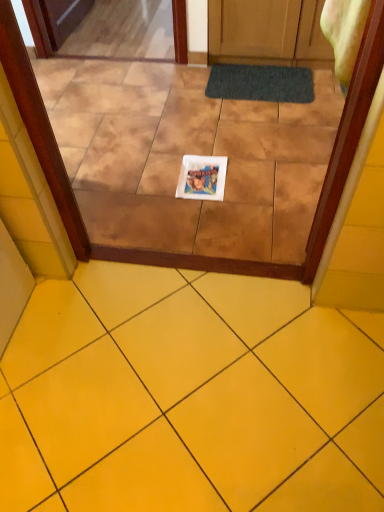
Find the location of a particular element. free space behind white paper at center is located at coordinates (196, 146).